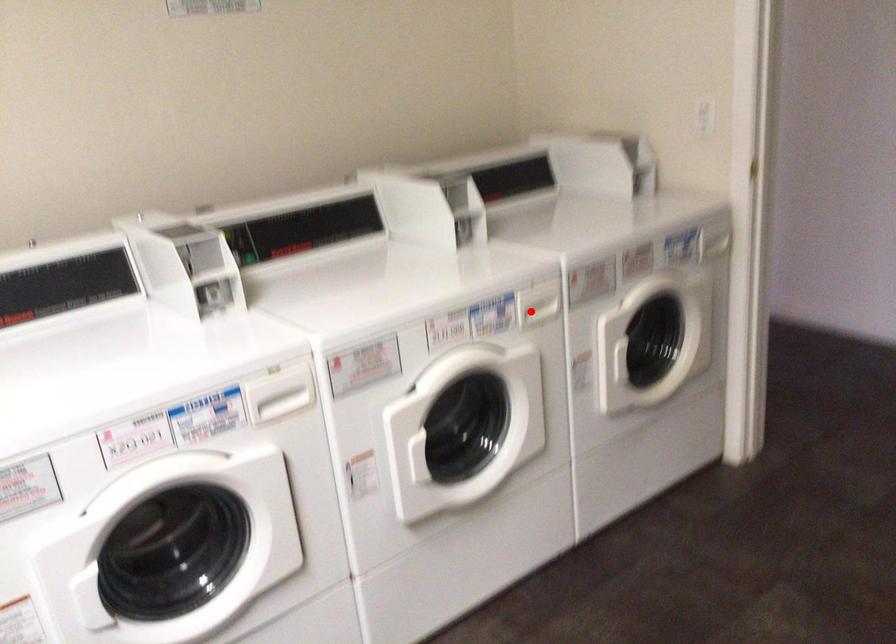
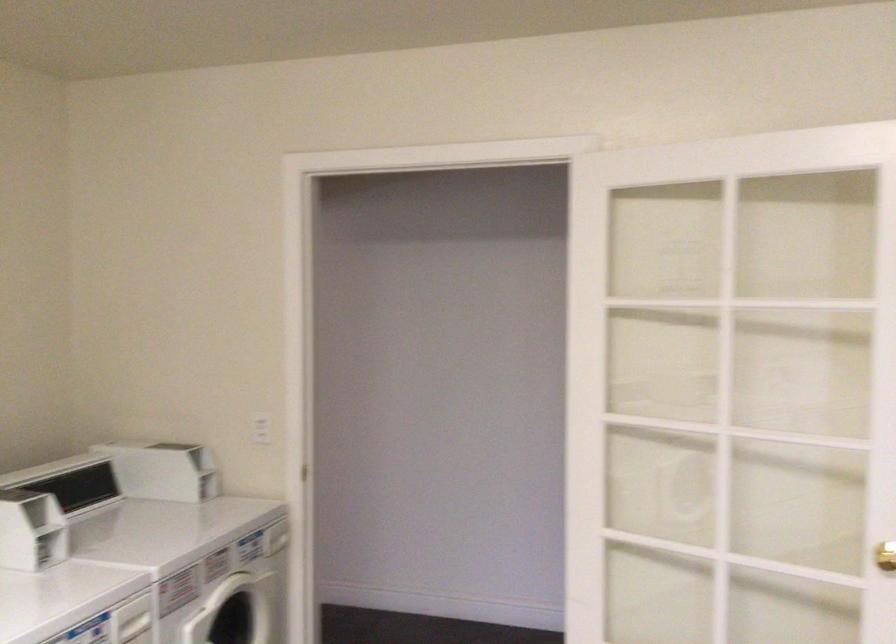
In the second image, find the point that corresponds to the highlighted location in the first image.

(133, 621)